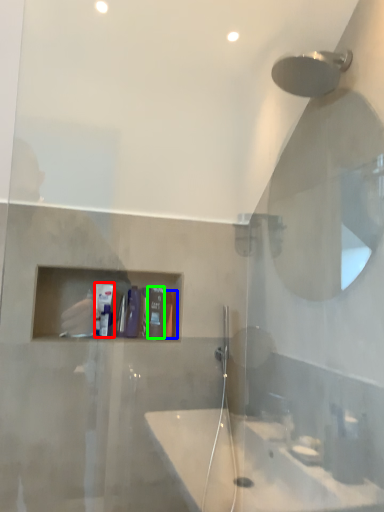
Question: Based on their relative distances, which object is nearer to toiletry (highlighted by a red box)? Choose from toiletry (highlighted by a blue box) and toiletry (highlighted by a green box).

Choices:
 (A) toiletry
 (B) toiletry

Answer: (B)